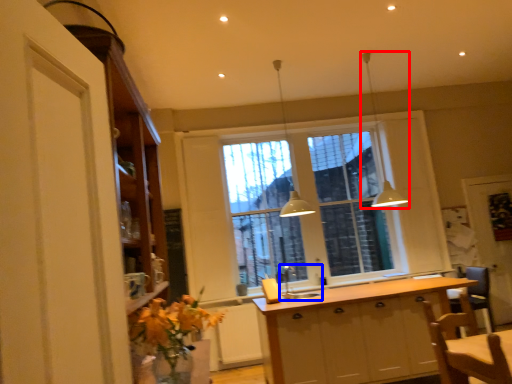
Question: Which object is closer to the camera taking this photo, light fixture (highlighted by a red box) or sink (highlighted by a blue box)?

Choices:
 (A) light fixture
 (B) sink

Answer: (B)